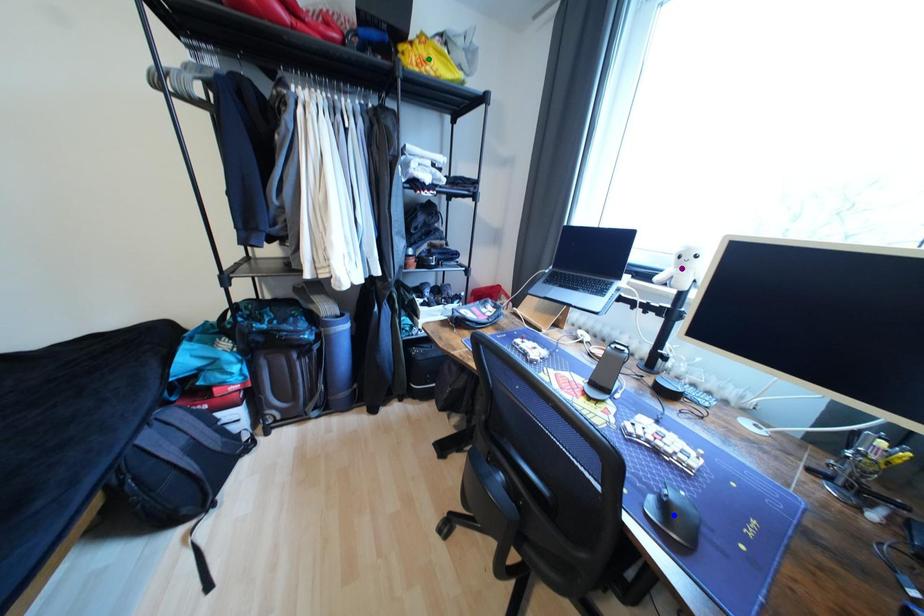
Order these from nearest to farthest:
purple point, green point, blue point

blue point → purple point → green point